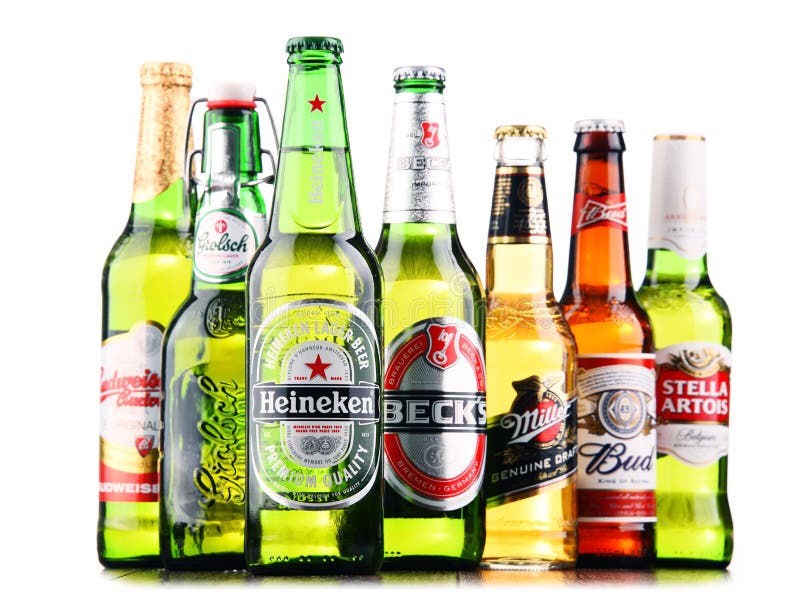
Find the location of a particular element. This screenshot has width=800, height=598. glass bottles is located at coordinates (156, 288), (208, 338), (300, 318), (432, 328), (508, 334), (608, 334), (690, 331).